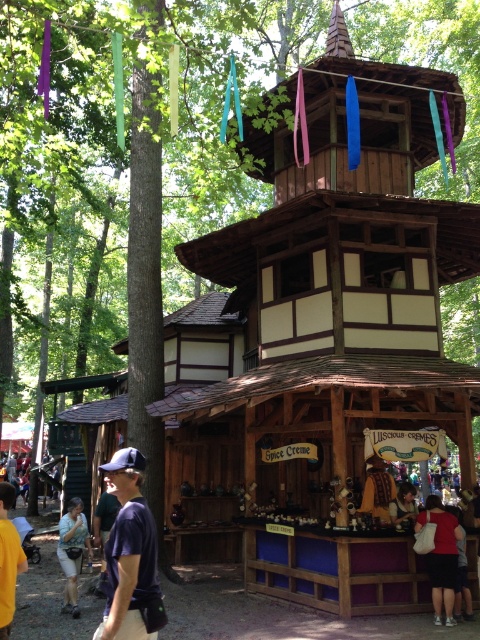
You are a customer at the Spice Creme stall and want to know if there is enough space to place a large order. You see the matte red shirt at lower right and the light blue denim shorts at lower left. Which item takes up more space?

The light blue denim shorts at lower left take up more space than the matte red shirt at lower right, so there might be enough space for your large order near the light blue denim shorts at lower left.

You are standing in front of the pagoda structure and want to approach the Spice Creme stall. Which item, the matte red shirt at lower right or the light blue denim shorts at lower left, would you need to walk around to reach the stall?

The matte red shirt at lower right is in front of the light blue denim shorts at lower left, so you would need to walk around the matte red shirt at lower right to reach the Spice Creme stall.

You are a customer standing in front of the Spice Creme stall. You notice two items for sale here. The dark blue fabric cap at lower left and the matte red shirt at lower right. Which item is shorter in height?

The dark blue fabric cap at lower left is shorter than the matte red shirt at lower right.